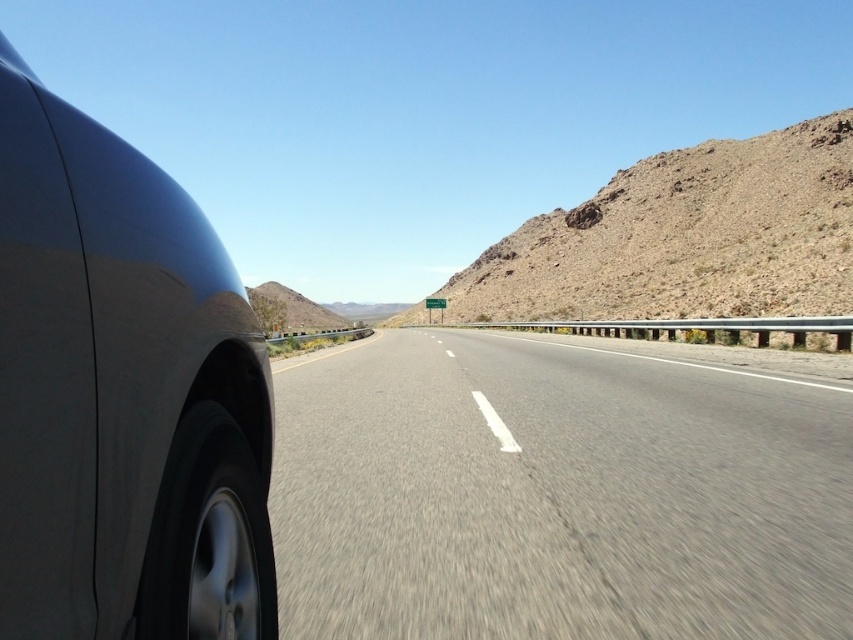
Question: Which object is farther from the camera taking this photo?

Choices:
 (A) brown rocky mountain at center
 (B) asphalt road at center
 (C) brown rocky mountain at upper right

Answer: (A)

Question: Considering the relative positions of asphalt road at center and brown rocky mountain at center in the image provided, where is asphalt road at center located with respect to brown rocky mountain at center?

Choices:
 (A) above
 (B) below

Answer: (B)

Question: Can you confirm if asphalt road at center is positioned above brown rocky mountain at center?

Choices:
 (A) no
 (B) yes

Answer: (A)

Question: Which point is farther to the camera?

Choices:
 (A) (508, 269)
 (B) (289, 321)
 (C) (592, 531)

Answer: (B)

Question: Can you confirm if asphalt road at center is wider than brown rocky mountain at upper right?

Choices:
 (A) yes
 (B) no

Answer: (B)

Question: Considering the real-world distances, which object is farthest from the brown rocky mountain at upper right?

Choices:
 (A) satin metallic car at left
 (B) brown rocky mountain at center

Answer: (A)